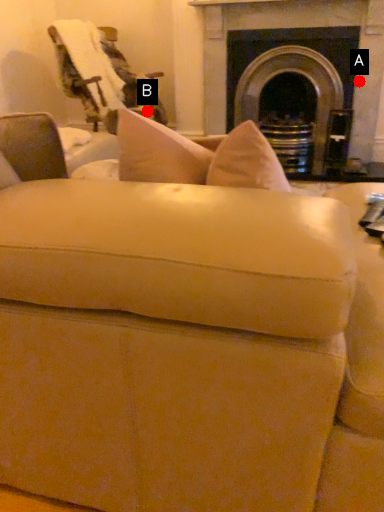
Question: Two points are circled on the image, labeled by A and B beside each circle. Which point is further to the camera?

Choices:
 (A) A is further
 (B) B is further

Answer: (B)